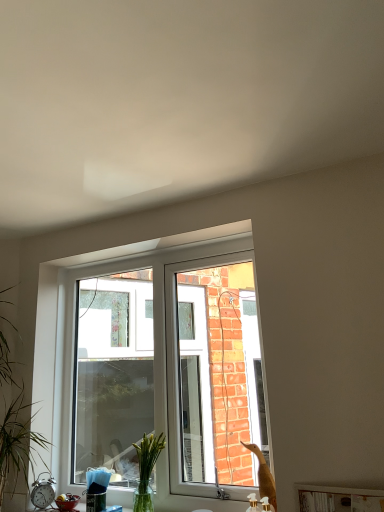
What is the approximate width of white plastic window at center?

white plastic window at center is 1.26 inches wide.

In order to face silver metallic alarm clock at lower left, should I rotate leftwards or rightwards?

Rotate your view left by about 19.235°.

What is the approximate width of green leafy plant at left?

The width of green leafy plant at left is 29.30 centimeters.

Where is `white plastic window at center`? white plastic window at center is located at coordinates (158, 364).

From the image's perspective, is clear glass vase at center above or below white plastic window at center?

From the image's perspective, clear glass vase at center appears below white plastic window at center.

What's the angular difference between clear glass vase at center and white plastic window at center's facing directions?

clear glass vase at center and white plastic window at center are facing 1.13 degrees away from each other.

Is point (145, 507) farther from viewer compared to point (219, 319)?

That is False.

Between clear glass vase at center and white plastic window at center, which one has larger size?

white plastic window at center is bigger.

Which is nearer, (138,499) or (33,475)?

Point (138,499) appears to be closer to the viewer than point (33,475).

Considering the sizes of objects clear glass vase at center and green leafy plant at left in the image provided, who is wider, clear glass vase at center or green leafy plant at left?

green leafy plant at left.

From a real-world perspective, who is located lower, clear glass vase at center or green leafy plant at left?

From a 3D spatial view, clear glass vase at center is below.

In the scene shown: Is clear glass vase at center positioned behind green leafy plant at left?

Yes, clear glass vase at center is further from the viewer.

Is point (34, 498) less distant than point (143, 449)?

No.

From the image's perspective, which one is positioned lower, silver metallic alarm clock at lower left or clear glass vase at center?

From the image's view, silver metallic alarm clock at lower left is below.

Considering the relative positions of silver metallic alarm clock at lower left and clear glass vase at center in the image provided, is silver metallic alarm clock at lower left to the left or to the right of clear glass vase at center?

Clearly, silver metallic alarm clock at lower left is on the left of clear glass vase at center in the image.

Is silver metallic alarm clock at lower left situated inside clear glass vase at center or outside?

silver metallic alarm clock at lower left is not enclosed by clear glass vase at center.

Does point (2, 423) come closer to viewer compared to point (375, 492)?

No, (2, 423) is further to viewer.

Is green leafy plant at left not inside white glossy wood at lower center?

Indeed, green leafy plant at left is completely outside white glossy wood at lower center.

From a real-world perspective, is green leafy plant at left on white glossy wood at lower center?

Yes.

Which is more to the left, white glossy wood at lower center or green leafy plant at left?

green leafy plant at left.

Which is in front, point (361, 509) or point (11, 365)?

The point (361, 509) is in front.

This screenshot has width=384, height=512. Identify the location of window sill in front of the green leafy plant at left. (339, 499).

Between white plastic window at center and white glossy wood at lower center, which one has larger width?

white glossy wood at lower center.

From the picture: From a real-world perspective, is white plastic window at center physically above white glossy wood at lower center?

Indeed, from a real-world perspective, white plastic window at center stands above white glossy wood at lower center.

Does white plastic window at center come in front of white glossy wood at lower center?

No, it is behind white glossy wood at lower center.

Is white plastic window at center oriented away from white glossy wood at lower center?

No, white plastic window at center is not facing away from white glossy wood at lower center.

Between silver metallic alarm clock at lower left and green leafy plant at left, which one appears on the left side from the viewer's perspective?

green leafy plant at left is more to the left.

Is point (37, 496) positioned after point (1, 467)?

Yes, it is.

From a real-world perspective, is silver metallic alarm clock at lower left on green leafy plant at left?

No, from a real-world perspective, silver metallic alarm clock at lower left is not over green leafy plant at left

Is silver metallic alarm clock at lower left facing towards green leafy plant at left?

No, silver metallic alarm clock at lower left is not facing towards green leafy plant at left.

I want to click on window above the clear glass vase at center (from a real-world perspective), so click(158, 364).

Locate an element on the screen. houseplant in front of the clear glass vase at center is located at coordinates (16, 424).

Which object lies further to the anchor point clear glass vase at center, green leafy plant at left or silver metallic alarm clock at lower left?

green leafy plant at left is positioned further to the anchor clear glass vase at center.

Based on their spatial positions, is white plastic window at center or clear glass vase at center further from silver metallic alarm clock at lower left?

Based on the image, white plastic window at center appears to be further to silver metallic alarm clock at lower left.

Based on their spatial positions, is white plastic window at center or white glossy wood at lower center closer to clear glass vase at center?

white plastic window at center is closer to clear glass vase at center.

From the picture: Which object lies further to the anchor point green leafy plant at left, white glossy wood at lower center or clear glass vase at center?

white glossy wood at lower center.

Estimate the real-world distances between objects in this image. Which object is closer to silver metallic alarm clock at lower left, green leafy plant at left or white glossy wood at lower center?

green leafy plant at left is positioned closer to the anchor silver metallic alarm clock at lower left.

In the scene shown: Based on their spatial positions, is white plastic window at center or silver metallic alarm clock at lower left further from white glossy wood at lower center?

silver metallic alarm clock at lower left lies further to white glossy wood at lower center than the other object.

Looking at this image, looking at the image, which one is located closer to silver metallic alarm clock at lower left, clear glass vase at center or white plastic window at center?

clear glass vase at center lies closer to silver metallic alarm clock at lower left than the other object.

Based on their spatial positions, is white glossy wood at lower center or clear glass vase at center closer to white plastic window at center?

clear glass vase at center is closer to white plastic window at center.

Identify the location of alarm clock situated between green leafy plant at left and white glossy wood at lower center from left to right. The width and height of the screenshot is (384, 512). (43, 492).

The height and width of the screenshot is (512, 384). I want to click on plant between silver metallic alarm clock at lower left and white glossy wood at lower center, so click(x=146, y=470).

Where is `alarm clock situated between green leafy plant at left and clear glass vase at center from left to right`? The width and height of the screenshot is (384, 512). alarm clock situated between green leafy plant at left and clear glass vase at center from left to right is located at coordinates (43, 492).

You are a GUI agent. You are given a task and a screenshot of the screen. Output one action in this format:
    pyautogui.click(x=<x>, y=<y>)
    Task: Click on the alarm clock between green leafy plant at left and white plastic window at center
    This screenshot has width=384, height=512.
    Given the screenshot: What is the action you would take?
    pyautogui.click(x=43, y=492)